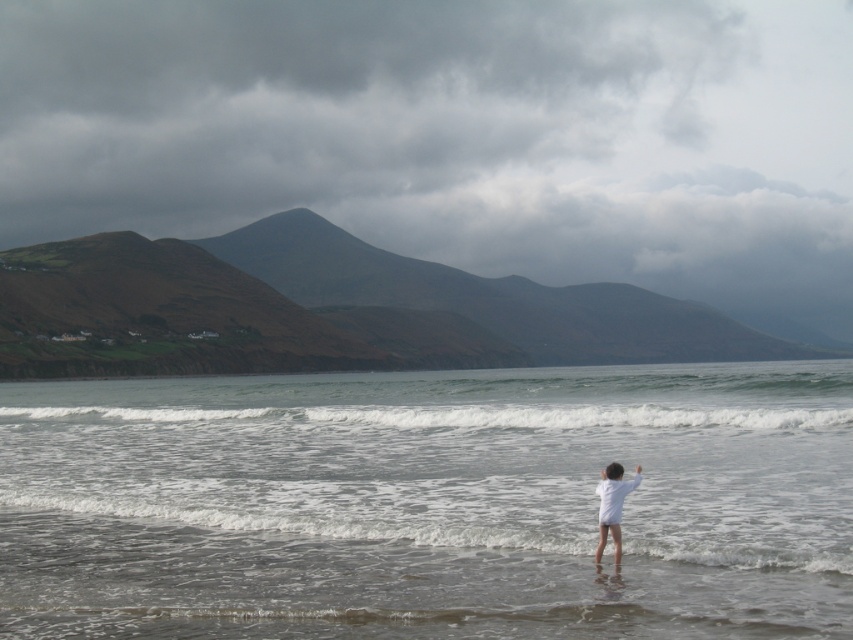
Question: Which point is farther to the camera?

Choices:
 (A) (741, 488)
 (B) (608, 509)
 (C) (633, 417)

Answer: (C)

Question: Which point appears farthest from the camera in this image?

Choices:
 (A) (212, 419)
 (B) (599, 506)
 (C) (264, 556)

Answer: (A)

Question: Where is clear water at lower center located in relation to white matte shirt at lower right in the image?

Choices:
 (A) right
 (B) left

Answer: (B)

Question: Which point appears farthest from the camera in this image?

Choices:
 (A) (45, 420)
 (B) (608, 506)

Answer: (A)

Question: Does clear water at lower center lie in front of white matte shirt at lower right?

Choices:
 (A) yes
 (B) no

Answer: (A)

Question: Is white foamy wave at center closer to the viewer compared to white matte shirt at lower right?

Choices:
 (A) yes
 (B) no

Answer: (B)